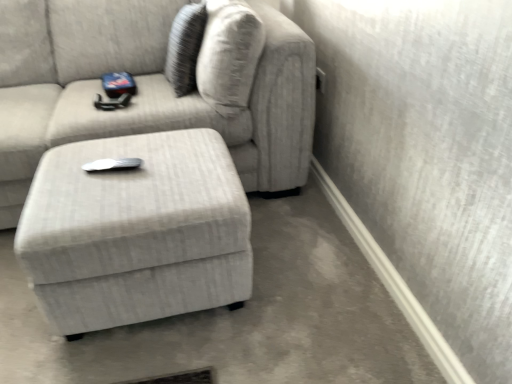
Question: Is light gray fabric ottoman at center facing towards textured fabric couch at center?

Choices:
 (A) yes
 (B) no

Answer: (B)

Question: Can you confirm if light gray fabric ottoman at center is taller than textured fabric couch at center?

Choices:
 (A) no
 (B) yes

Answer: (A)

Question: Is light gray fabric ottoman at center at the left side of textured fabric couch at center?

Choices:
 (A) yes
 (B) no

Answer: (B)

Question: Is light gray fabric ottoman at center far away from textured fabric couch at center?

Choices:
 (A) no
 (B) yes

Answer: (A)

Question: Does light gray fabric ottoman at center appear on the right side of textured fabric couch at center?

Choices:
 (A) yes
 (B) no

Answer: (A)

Question: Is textured fabric couch at center completely or partially inside light gray fabric ottoman at center?

Choices:
 (A) no
 (B) yes

Answer: (A)

Question: Is textured fabric couch at center further to the viewer compared to light gray fabric ottoman at center?

Choices:
 (A) no
 (B) yes

Answer: (B)

Question: Is textured fabric couch at center not close to light gray fabric ottoman at center?

Choices:
 (A) no
 (B) yes

Answer: (A)

Question: From the image's perspective, would you say textured fabric couch at center is shown under light gray fabric ottoman at center?

Choices:
 (A) no
 (B) yes

Answer: (A)

Question: Is textured fabric couch at center positioned in front of light gray fabric ottoman at center?

Choices:
 (A) no
 (B) yes

Answer: (A)

Question: Is textured fabric couch at center looking in the opposite direction of light gray fabric ottoman at center?

Choices:
 (A) no
 (B) yes

Answer: (A)

Question: From a real-world perspective, is textured fabric couch at center under light gray fabric ottoman at center?

Choices:
 (A) yes
 (B) no

Answer: (B)

Question: Based on their sizes in the image, would you say light gray fabric ottoman at center is bigger or smaller than textured fabric couch at center?

Choices:
 (A) big
 (B) small

Answer: (B)